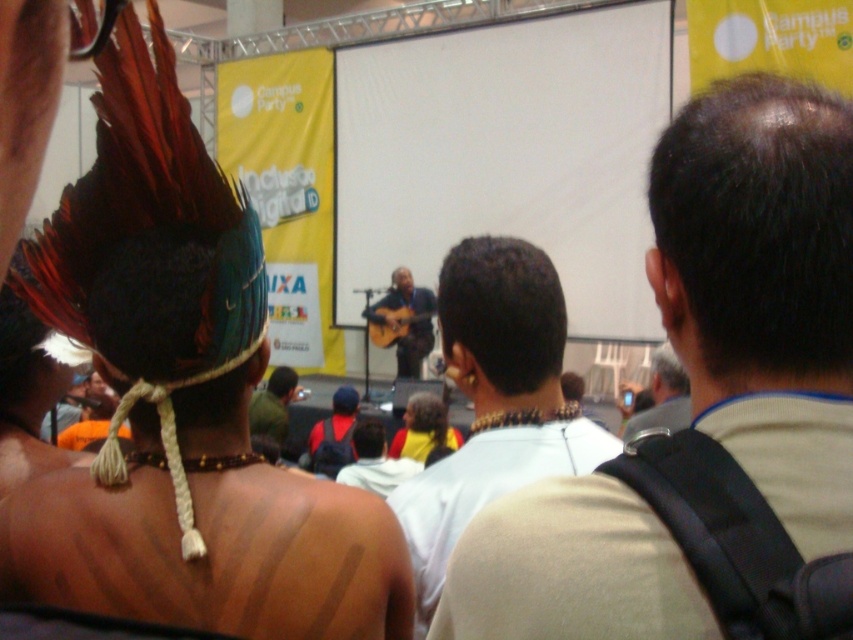
Based on the photo, is light brown hair at center behind smooth brown guitar at center?

No.

Based on the photo, which of these two, light brown hair at center or smooth brown guitar at center, stands taller?

smooth brown guitar at center is taller.

Locate an element on the screen. Image resolution: width=853 pixels, height=640 pixels. light brown hair at center is located at coordinates (764, 289).

Does dark brown leather jacket at center appear over acoustic guitar at center?

Incorrect, dark brown leather jacket at center is not positioned above acoustic guitar at center.

Can you confirm if dark brown leather jacket at center is wider than acoustic guitar at center?

No, dark brown leather jacket at center is not wider than acoustic guitar at center.

Who is more distant from viewer, (256,428) or (402,332)?

Positioned behind is point (402,332).

Identify the location of dark brown leather jacket at center. The height and width of the screenshot is (640, 853). (273, 404).

Can you confirm if feathered headdress at upper left is positioned below dark brown leather jacket at center?

No, feathered headdress at upper left is not below dark brown leather jacket at center.

Which is in front, point (221, 220) or point (273, 420)?

Point (221, 220)

I want to click on feathered headdress at upper left, so click(141, 257).